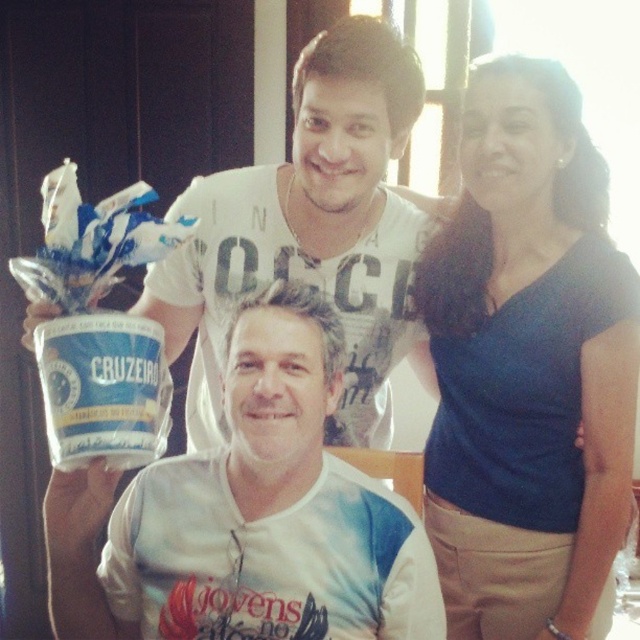
Based on the coordinates provided, which object is located at point (529,365)?

The point (529,365) corresponds to the blue cotton shirt at upper right.

You are taking a photo of the scene described. You want to ensure that the point at coordinates point (516, 173) is in focus. If your camera has a depth of field that can sharply focus on objects within 4 feet from the current focus point, where should you set the focus to capture this point clearly?

You should set the focus at the point (516, 173) because it is only 4.17 feet away from the camera, which is within the 4 feet depth of field range. This ensures the point remains sharp in the photo.

You are standing in the room where the photo was taken. You want to find the blue cotton shirt at upper right. According to the coordinates given, where should you look?

The blue cotton shirt at upper right is located at the 2D coordinates point (529, 365) in the image.